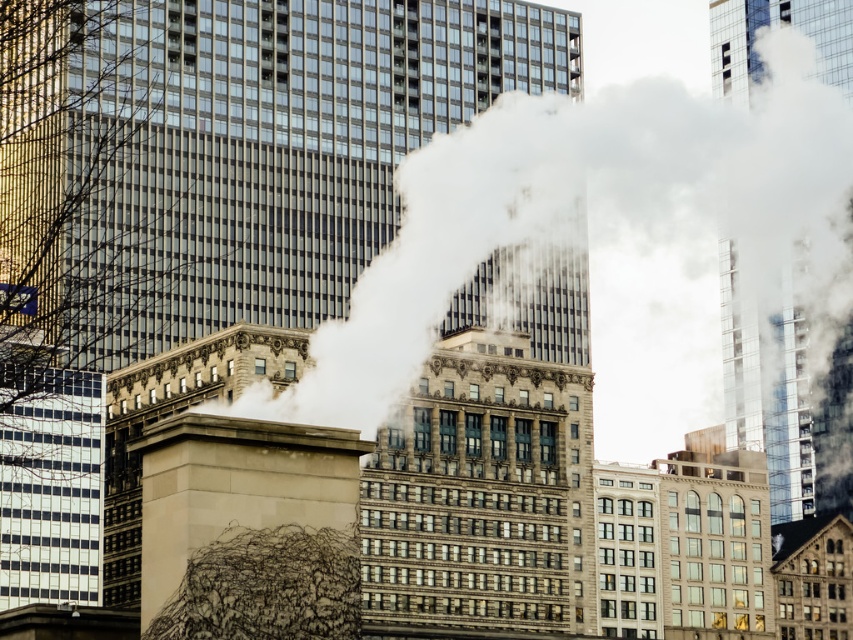
Is the position of white smoke at center less distant than that of beige stone chimney at center?

No, white smoke at center is behind beige stone chimney at center.

Does white smoke at center appear on the right side of beige stone chimney at center?

Indeed, white smoke at center is positioned on the right side of beige stone chimney at center.

Where is `white smoke at center`? white smoke at center is located at coordinates (596, 232).